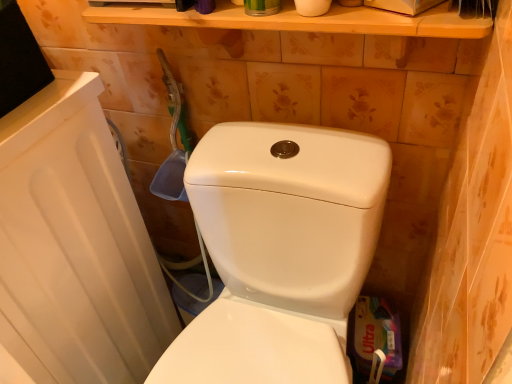
The image size is (512, 384). Describe the element at coordinates (312, 7) in the screenshot. I see `white matte toilet paper at upper center` at that location.

In order to click on white matte toilet paper at upper center in this screenshot , I will do `click(312, 7)`.

Find the location of a particular element. Image resolution: width=512 pixels, height=384 pixels. white glossy toilet at center is located at coordinates [x=280, y=251].

What is the approximate height of white glossy toilet at center?

white glossy toilet at center is 30.07 inches in height.

Describe the element at coordinates (280, 251) in the screenshot. I see `white glossy toilet at center` at that location.

I want to click on white matte toilet paper at upper center, so pos(312,7).

Can you confirm if white glossy toilet at center is positioned to the left of white matte toilet paper at upper center?

Correct, you'll find white glossy toilet at center to the left of white matte toilet paper at upper center.

Is white glossy toilet at center positioned in front of white matte toilet paper at upper center?

Yes, the depth of white glossy toilet at center is less than that of white matte toilet paper at upper center.

Which point is more forward, (x=232, y=142) or (x=321, y=7)?

The point (x=321, y=7) is closer.

From the image's perspective, is white glossy toilet at center over white matte toilet paper at upper center?

No, from the image's perspective, white glossy toilet at center is not above white matte toilet paper at upper center.

From a real-world perspective, is white glossy toilet at center under white matte toilet paper at upper center?

Yes, from a real-world perspective, white glossy toilet at center is below white matte toilet paper at upper center.

Considering the sizes of white glossy toilet at center and white matte toilet paper at upper center in the image, is white glossy toilet at center wider or thinner than white matte toilet paper at upper center?

Clearly, white glossy toilet at center has more width compared to white matte toilet paper at upper center.

Which of these two, white glossy toilet at center or white matte toilet paper at upper center, stands shorter?

With less height is white matte toilet paper at upper center.

Considering the relative sizes of white glossy toilet at center and white matte toilet paper at upper center in the image provided, is white glossy toilet at center bigger than white matte toilet paper at upper center?

Indeed, white glossy toilet at center has a larger size compared to white matte toilet paper at upper center.

Based on the photo, is white glossy toilet at center inside the boundaries of white matte toilet paper at upper center, or outside?

white glossy toilet at center is spatially situated outside white matte toilet paper at upper center.

Is there a large distance between white glossy toilet at center and white matte toilet paper at upper center?

Actually, white glossy toilet at center and white matte toilet paper at upper center are a little close together.

Could you tell me if white glossy toilet at center is facing white matte toilet paper at upper center?

No, white glossy toilet at center is not turned towards white matte toilet paper at upper center.

How distant is white glossy toilet at center from white matte toilet paper at upper center?

white glossy toilet at center and white matte toilet paper at upper center are 16.30 inches apart from each other.

The image size is (512, 384). In the image, there is a white matte toilet paper at upper center. Identify the location of toilet below it (from a real-world perspective). (280, 251).

Considering the relative positions of white matte toilet paper at upper center and white glossy toilet at center in the image provided, is white matte toilet paper at upper center to the left of white glossy toilet at center from the viewer's perspective?

No, white matte toilet paper at upper center is not to the left of white glossy toilet at center.

Which object is more forward, white matte toilet paper at upper center or white glossy toilet at center?

white glossy toilet at center is more forward.

Which is behind, point (303, 1) or point (234, 208)?

The point (234, 208) is behind.

From the image's perspective, is white matte toilet paper at upper center located above white glossy toilet at center?

Correct, white matte toilet paper at upper center appears higher than white glossy toilet at center in the image.

From a real-world perspective, is white matte toilet paper at upper center located higher than white glossy toilet at center?

Yes.

Does white matte toilet paper at upper center have a lesser width compared to white glossy toilet at center?

Indeed, white matte toilet paper at upper center has a lesser width compared to white glossy toilet at center.

Based on the photo, considering the relative sizes of white matte toilet paper at upper center and white glossy toilet at center in the image provided, is white matte toilet paper at upper center shorter than white glossy toilet at center?

Yes.

Between white matte toilet paper at upper center and white glossy toilet at center, which one has larger size?

white glossy toilet at center.

Choose the correct answer: Is white matte toilet paper at upper center inside white glossy toilet at center or outside it?

white matte toilet paper at upper center lies outside white glossy toilet at center.

Does white matte toilet paper at upper center touch white glossy toilet at center?

No, white matte toilet paper at upper center is not with white glossy toilet at center.

Does white matte toilet paper at upper center turn towards white glossy toilet at center?

No, white matte toilet paper at upper center is not aimed at white glossy toilet at center.

Locate an element on the screen. The image size is (512, 384). toilet that is on the left side of white matte toilet paper at upper center is located at coordinates (280, 251).

Locate an element on the screen. toilet that appears in front of the white matte toilet paper at upper center is located at coordinates (280, 251).

You are a GUI agent. You are given a task and a screenshot of the screen. Output one action in this format:
    pyautogui.click(x=<x>, y=<y>)
    Task: Click on the toilet paper lying above the white glossy toilet at center (from the image's perspective)
    The image size is (512, 384).
    Given the screenshot: What is the action you would take?
    pyautogui.click(x=312, y=7)